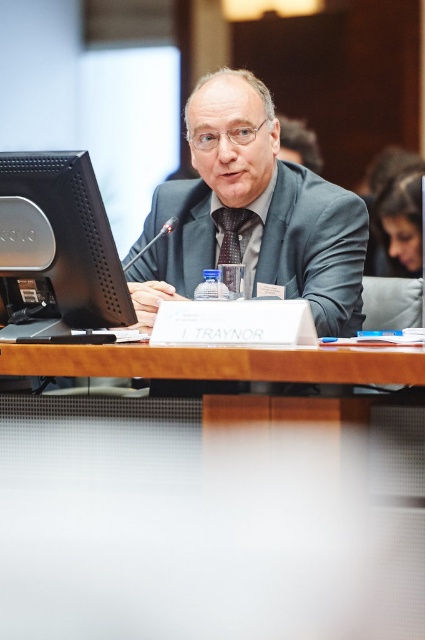
Question: From the image, what is the correct spatial relationship of matte gray suit at center in relation to brown textured tie at center?

Choices:
 (A) right
 (B) left

Answer: (B)

Question: Which of these objects is positioned closest to the wooden table at center?

Choices:
 (A) matte gray suit at center
 (B) brown textured tie at center

Answer: (A)

Question: Which point appears farthest from the camera in this image?

Choices:
 (A) click(342, 376)
 (B) click(243, 104)
 (C) click(237, 237)

Answer: (C)

Question: Can you confirm if matte gray suit at center is smaller than brown textured tie at center?

Choices:
 (A) no
 (B) yes

Answer: (A)

Question: Which point is closer to the camera?

Choices:
 (A) (79, 324)
 (B) (340, 365)
 (C) (235, 221)
 (D) (190, 128)

Answer: (B)

Question: Is black plastic monitor at left below brown textured tie at center?

Choices:
 (A) no
 (B) yes

Answer: (B)